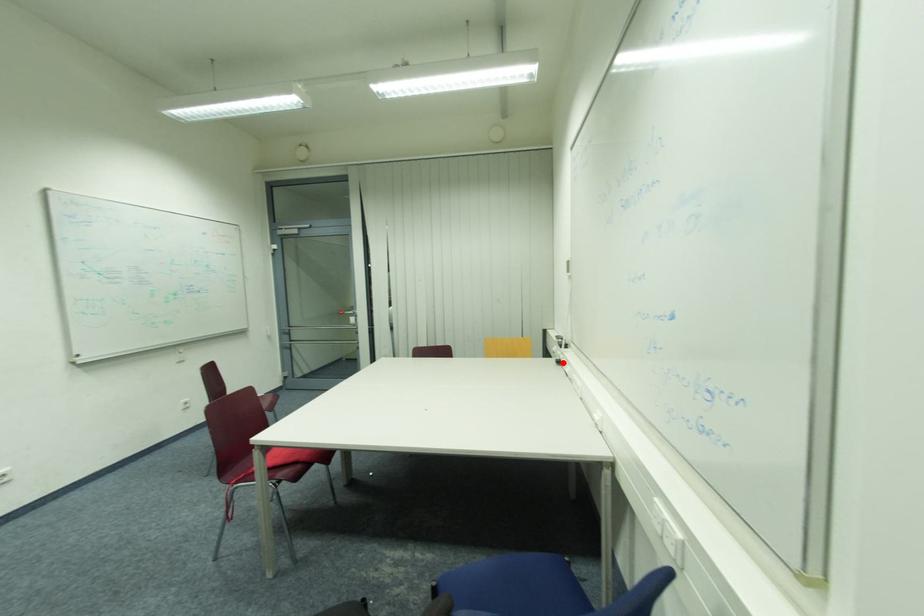
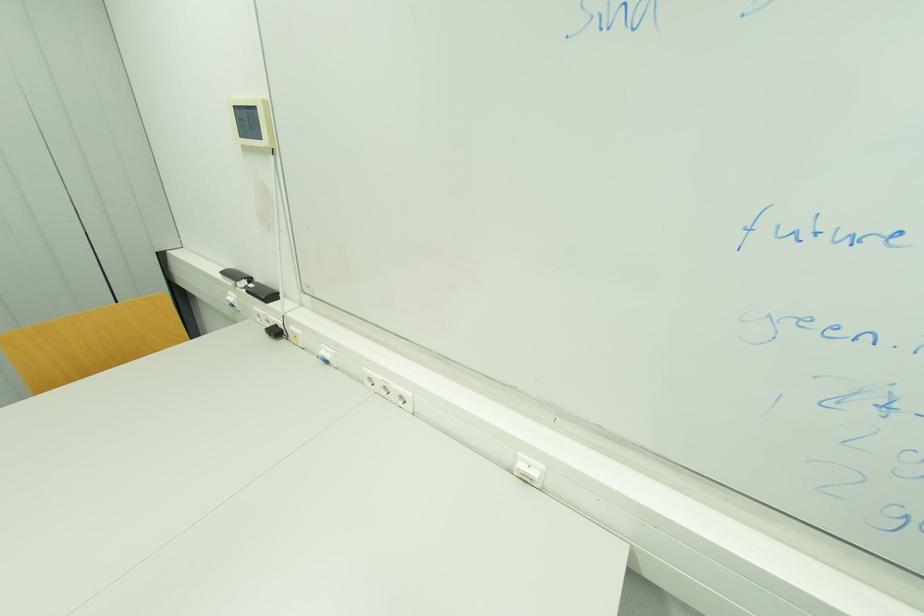
The point at the highlighted location is marked in the first image. Where is the corresponding point in the second image?

(281, 333)